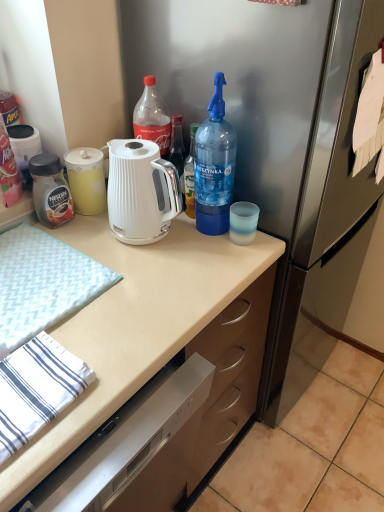
Image resolution: width=384 pixels, height=512 pixels. In order to click on free point below white glossy electric kettle at center (from a real-world perspective) in this screenshot , I will do `click(162, 241)`.